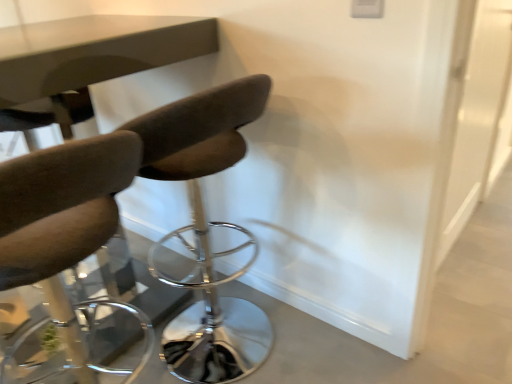
Question: Is matte brown chair at left, the second chair positioned from the right, positioned with its back to transparent glass door at right?

Choices:
 (A) yes
 (B) no

Answer: (B)

Question: Can you confirm if matte brown chair at left, the 1th chair from the left, is positioned to the right of transparent glass door at right?

Choices:
 (A) yes
 (B) no

Answer: (B)

Question: Does matte brown chair at left, the second chair positioned from the right, come in front of transparent glass door at right?

Choices:
 (A) yes
 (B) no

Answer: (A)

Question: Is matte brown chair at left, the second chair positioned from the right, taller than transparent glass door at right?

Choices:
 (A) yes
 (B) no

Answer: (B)

Question: Is matte brown chair at left, the second chair positioned from the right, not inside transparent glass door at right?

Choices:
 (A) no
 (B) yes

Answer: (B)

Question: Considering their positions, is matte brown chair at left, the 1th chair from the left, located in front of or behind transparent glass door at right?

Choices:
 (A) front
 (B) behind

Answer: (A)

Question: From a real-world perspective, is matte brown chair at left, the 1th chair from the left, physically located above or below transparent glass door at right?

Choices:
 (A) below
 (B) above

Answer: (A)

Question: From their relative heights in the image, would you say matte brown chair at left, the second chair positioned from the right, is taller or shorter than transparent glass door at right?

Choices:
 (A) tall
 (B) short

Answer: (B)

Question: From the image's perspective, relative to transparent glass door at right, is matte brown chair at left, the 1th chair from the left, above or below?

Choices:
 (A) below
 (B) above

Answer: (A)

Question: In terms of width, does matte brown chair at left, the 1th chair from the left, look wider or thinner when compared to dark brown leather chair at center, the 1th chair from the right?

Choices:
 (A) thin
 (B) wide

Answer: (A)

Question: Is matte brown chair at left, the 1th chair from the left, inside the boundaries of dark brown leather chair at center, arranged as the second chair when viewed from the left, or outside?

Choices:
 (A) inside
 (B) outside

Answer: (B)

Question: From a real-world perspective, is matte brown chair at left, the second chair positioned from the right, above or below dark brown leather chair at center, the 1th chair from the right?

Choices:
 (A) below
 (B) above

Answer: (B)

Question: Does point (61, 221) appear closer or farther from the camera than point (219, 334)?

Choices:
 (A) farther
 (B) closer

Answer: (B)

Question: Does point (240, 140) appear closer or farther from the camera than point (457, 51)?

Choices:
 (A) closer
 (B) farther

Answer: (B)

Question: Considering their positions, is dark brown leather chair at center, arranged as the second chair when viewed from the left, located in front of or behind transparent glass door at right?

Choices:
 (A) front
 (B) behind

Answer: (A)